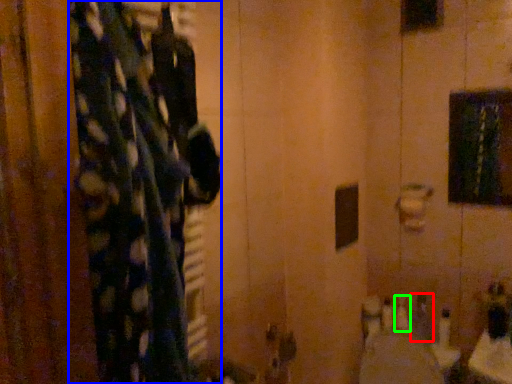
Question: Based on their relative distances, which object is nearer to toiletry (highlighted by a red box)? Choose from curtain (highlighted by a blue box) and toiletry (highlighted by a green box).

Choices:
 (A) curtain
 (B) toiletry

Answer: (B)